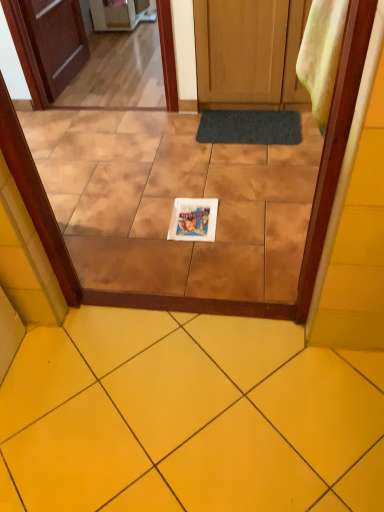
Locate an element on the screen. This screenshot has width=384, height=512. vacant space situated above white glossy magazine at center (from a real-world perspective) is located at coordinates (194, 217).